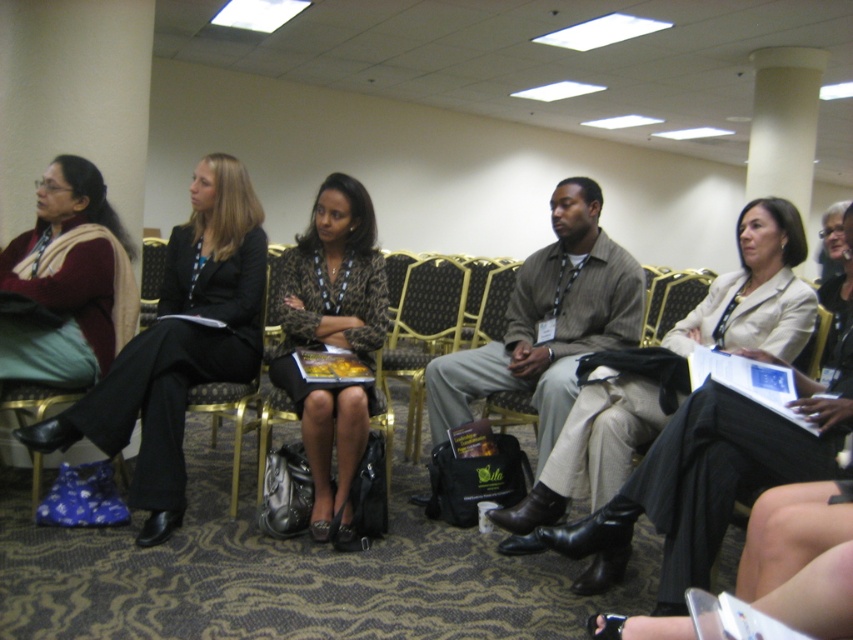
Question: Can you confirm if matte gray shirt at center is positioned above black fabric chair at center?

Choices:
 (A) yes
 (B) no

Answer: (A)

Question: Which is farther from the leopard print dress at center?

Choices:
 (A) beige fabric jacket at center
 (B) gold-patterned chair at center
 (C) matte black sweater at left

Answer: (A)

Question: Is matte black suit at left above leopard print dress at center?

Choices:
 (A) no
 (B) yes

Answer: (B)

Question: Based on their relative distances, which object is nearer to the beige fabric jacket at center?

Choices:
 (A) gold-patterned chair at center
 (B) matte black suit at left
 (C) matte black sweater at left

Answer: (A)

Question: Can you confirm if beige fabric jacket at center is positioned below matte black sweater at left?

Choices:
 (A) yes
 (B) no

Answer: (A)

Question: Which object is positioned farthest from the gold-patterned chair at center?

Choices:
 (A) matte black sweater at left
 (B) matte black suit at left
 (C) matte gray shirt at center

Answer: (A)